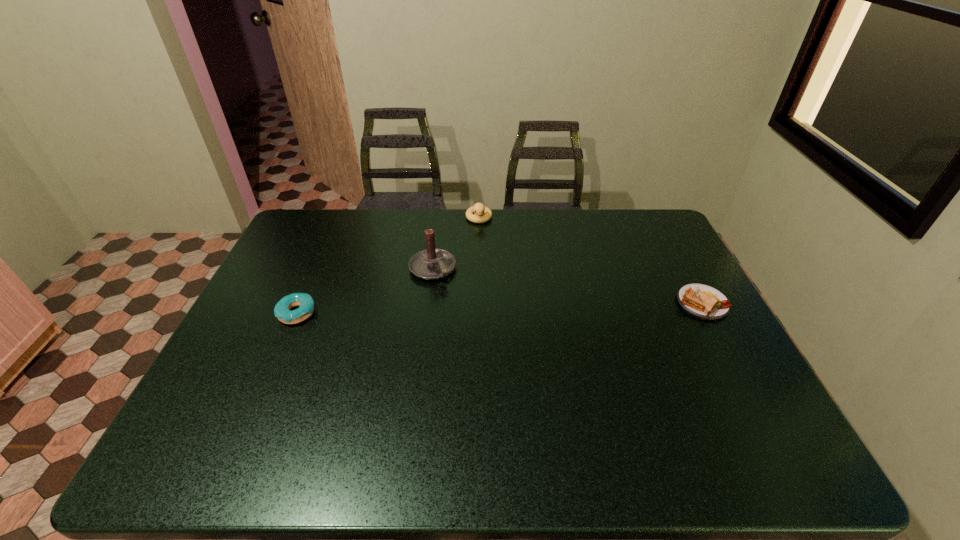
The height and width of the screenshot is (540, 960). Find the location of `vacant spot on the desktop that is between the leftmost object and the rightmost object and is positioned on the side of the tallest object with the handle loop`. vacant spot on the desktop that is between the leftmost object and the rightmost object and is positioned on the side of the tallest object with the handle loop is located at coordinates (463, 309).

Locate an element on the screen. The width and height of the screenshot is (960, 540). free spot on the desktop that is between the leftmost object and the sandwich and is positioned at the beak of the farthest object is located at coordinates (480, 308).